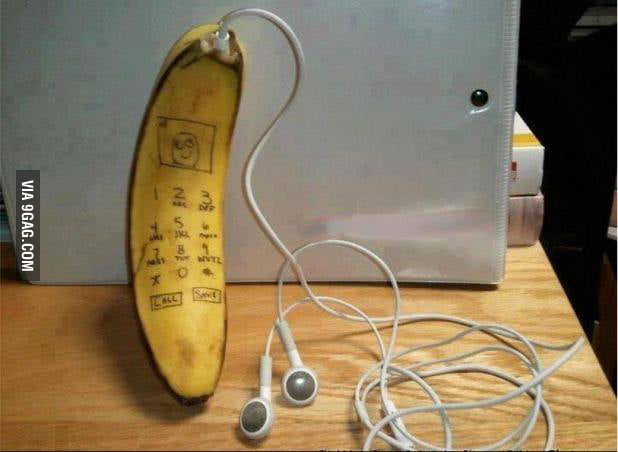
Find the location of a particular element. The width and height of the screenshot is (618, 452). books is located at coordinates (533, 221), (528, 171).